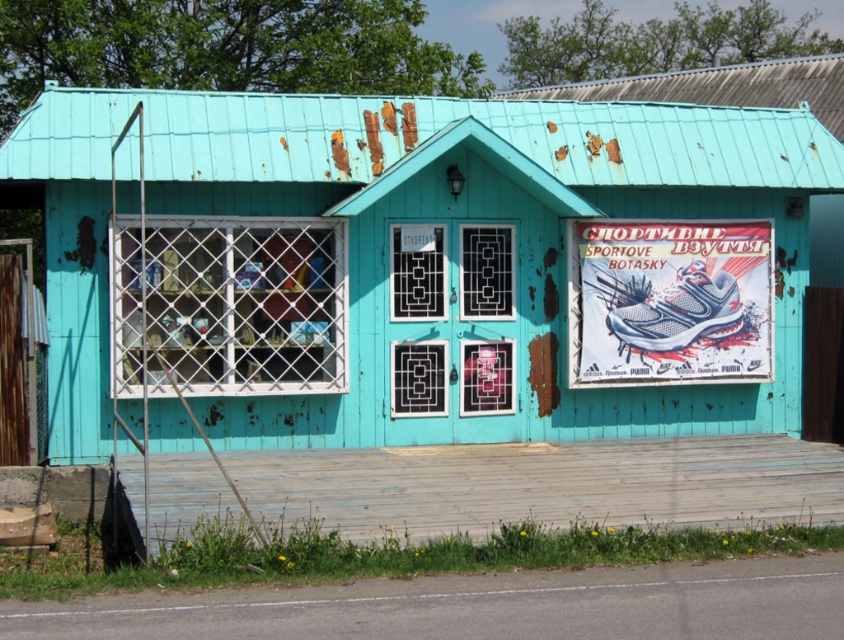
Question: Which object appears farthest from the camera in this image?

Choices:
 (A) white paper poster at upper right
 (B) teal wooden hut at center

Answer: (A)

Question: Does teal wooden hut at center appear on the left side of white paper poster at upper right?

Choices:
 (A) yes
 (B) no

Answer: (A)

Question: Does teal wooden hut at center have a smaller size compared to white paper poster at upper right?

Choices:
 (A) no
 (B) yes

Answer: (B)

Question: Does teal wooden hut at center have a greater width compared to white paper poster at upper right?

Choices:
 (A) yes
 (B) no

Answer: (B)

Question: Which point is closer to the camera?

Choices:
 (A) (604, 307)
 (B) (342, 268)

Answer: (B)

Question: Which point is closer to the camera taking this photo?

Choices:
 (A) (761, 289)
 (B) (211, 227)

Answer: (B)